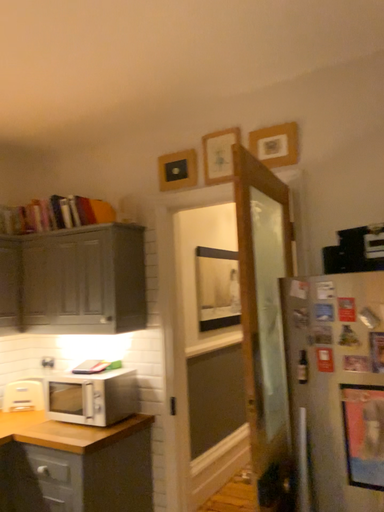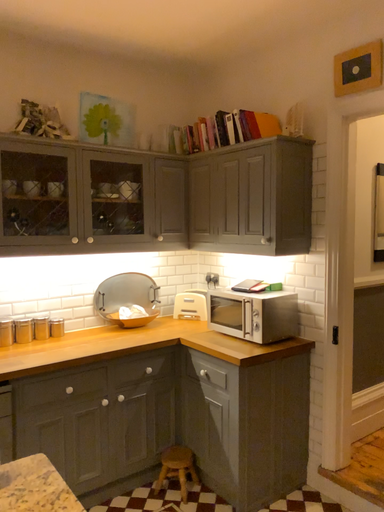
Question: How did the camera likely rotate when shooting the video?

Choices:
 (A) rotated downward
 (B) rotated upward

Answer: (A)